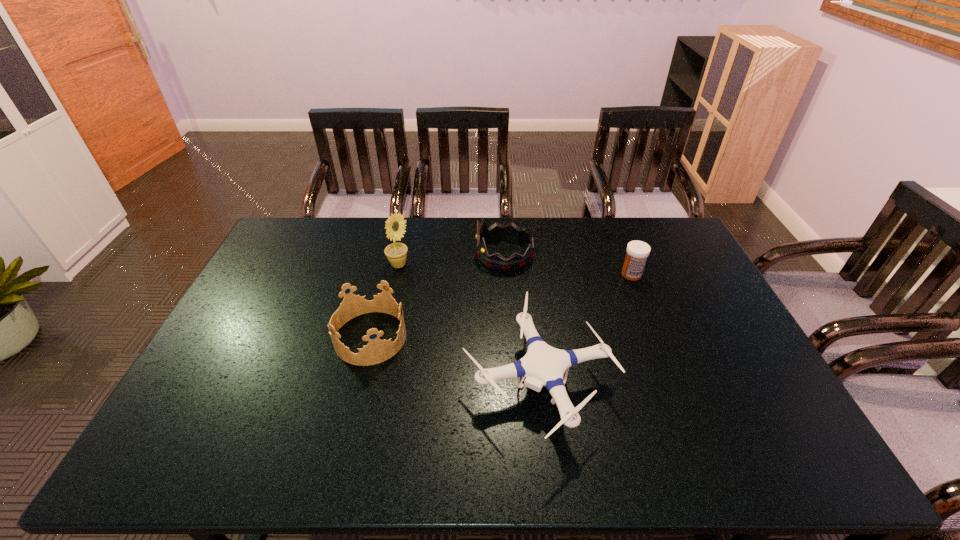
Image resolution: width=960 pixels, height=540 pixels. Find the location of `vacant space located 0.170m on the front of the medicine`. vacant space located 0.170m on the front of the medicine is located at coordinates (649, 318).

Locate an element on the screen. The width and height of the screenshot is (960, 540). vacant space located on the right of the drone is located at coordinates (634, 381).

At what (x,y) coordinates should I click in order to perform the action: click on object that is at the far edge. Please return your answer as a coordinate pair (x, y). Looking at the image, I should click on (497, 231).

The image size is (960, 540). I want to click on object located in the near edge section of the desktop, so click(543, 365).

You are a GUI agent. You are given a task and a screenshot of the screen. Output one action in this format:
    pyautogui.click(x=<x>, y=<y>)
    Task: Click on the vacant space at the far edge of the desktop
    This screenshot has width=960, height=540.
    Given the screenshot: What is the action you would take?
    pyautogui.click(x=568, y=224)

I want to click on vacant space at the near edge of the desktop, so click(316, 451).

At what (x,y) coordinates should I click in order to perform the action: click on vacant space at the left edge. Please return your answer as a coordinate pair (x, y). Looking at the image, I should click on (273, 305).

In the image, there is a desktop. At what (x,y) coordinates should I click in order to perform the action: click on free space at the right edge. Please return your answer as a coordinate pair (x, y). Looking at the image, I should click on (766, 435).

Locate an element on the screen. vacant space at the far left corner of the desktop is located at coordinates point(276,253).

This screenshot has width=960, height=540. Find the location of `free space between the nearer tiara and the right tiara`. free space between the nearer tiara and the right tiara is located at coordinates (437, 296).